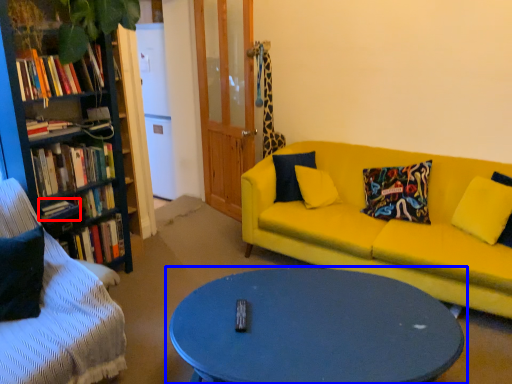
Question: Which object appears closest to the camera in this image, book (highlighted by a red box) or coffee table (highlighted by a blue box)?

Choices:
 (A) book
 (B) coffee table

Answer: (B)